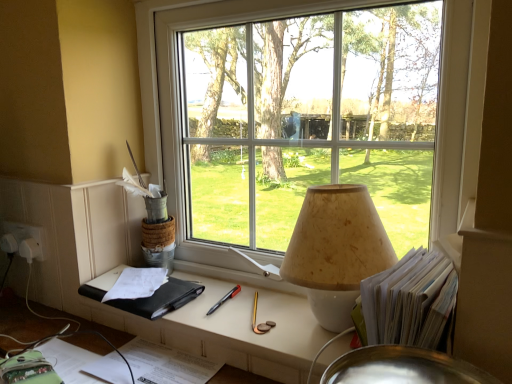
You are a GUI agent. You are given a task and a screenshot of the screen. Output one action in this format:
    pyautogui.click(x=<x>, y=<y>)
    Task: Click on the free spot below beige textured lampshade at center (from a real-world perspective)
    
    Given the screenshot: What is the action you would take?
    pyautogui.click(x=324, y=326)